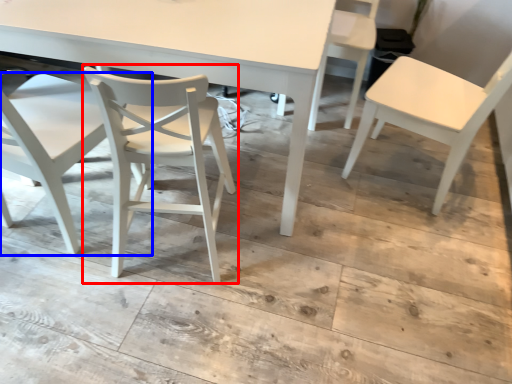
Question: Among these objects, which one is farthest to the camera, chair (highlighted by a red box) or chair (highlighted by a blue box)?

Choices:
 (A) chair
 (B) chair

Answer: (A)